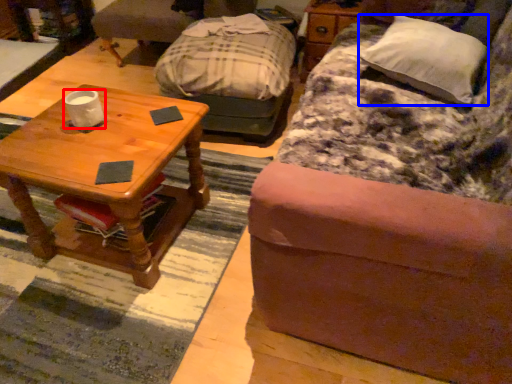
Question: Which object is further to the camera taking this photo, coffee cup (highlighted by a red box) or pillow (highlighted by a blue box)?

Choices:
 (A) coffee cup
 (B) pillow

Answer: (A)